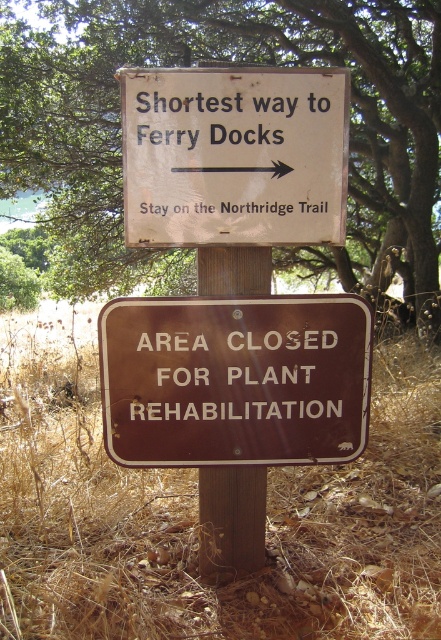
Looking at this image, you are a hiker carrying a backpack with a 1.2 meter long tent pole. You need to pass through the area between the white paper sign at center and the brown wood post at center. Can your tent pole fit through the space without bending it?

The distance between the white paper sign at center and the brown wood post at center is 1.09 meters. Since the tent pole is 1.2 meters long, it cannot fit through the space without bending it.

You are standing in a natural area and see the green leafy tree at upper center and the brown wood post at center. Which object is positioned to the left of the other?

The green leafy tree at upper center is to the left of brown wood post at center.

You are a hiker trying to determine the best path to reach the ferry docks. You see the white paper sign at center and the brown wood post at center. Which object provides information about the trail direction?

The white paper sign at center provides information about the trail direction as it states the shortest way to Ferry Docks and advises to stay on the Northridge Trail.